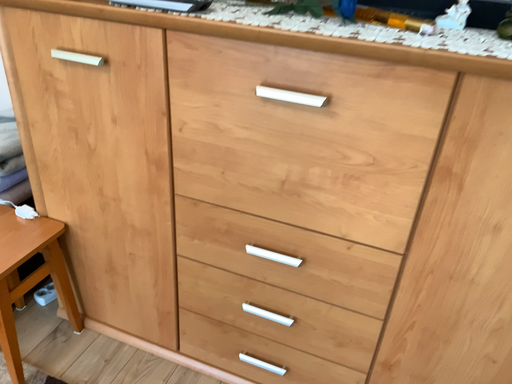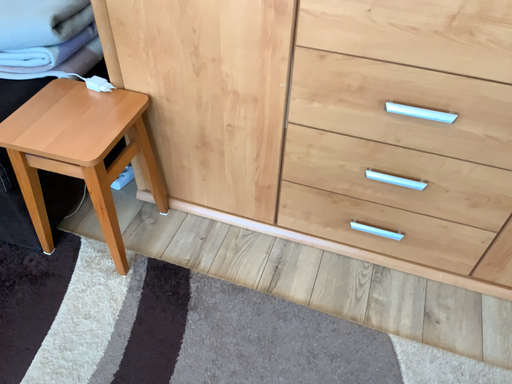
Question: How did the camera likely rotate when shooting the video?

Choices:
 (A) rotated upward
 (B) rotated downward

Answer: (B)